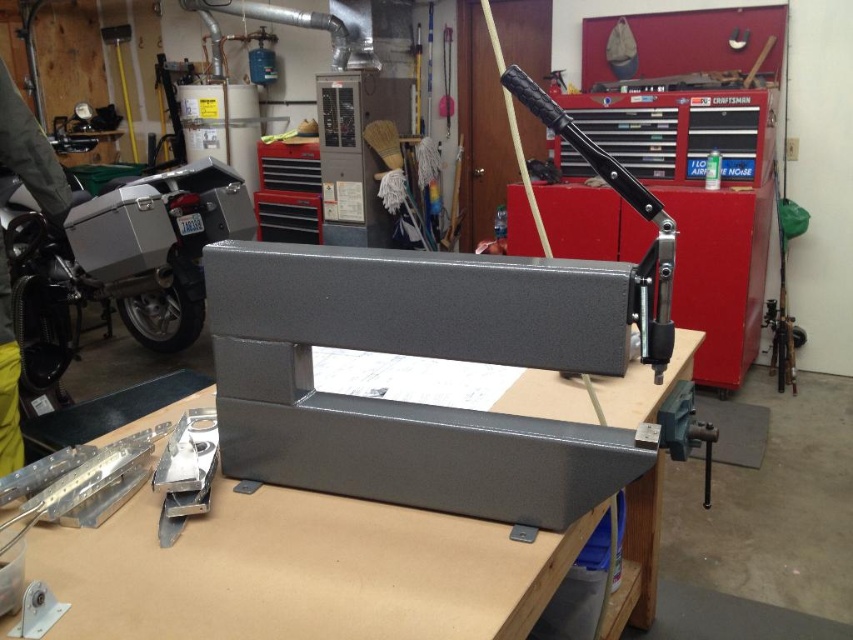
Question: Which object appears farthest from the camera in this image?

Choices:
 (A) matte black handle at upper center
 (B) brushed metal motorcycle at left

Answer: (B)

Question: Which object is closer to the camera taking this photo?

Choices:
 (A) matte black handle at upper center
 (B) brushed metal motorcycle at left

Answer: (A)

Question: Does brushed metal motorcycle at left lie in front of matte black handle at upper center?

Choices:
 (A) no
 (B) yes

Answer: (A)

Question: Does brushed metal motorcycle at left have a larger size compared to matte black handle at upper center?

Choices:
 (A) no
 (B) yes

Answer: (B)

Question: Does brushed metal motorcycle at left come in front of matte black handle at upper center?

Choices:
 (A) yes
 (B) no

Answer: (B)

Question: Which of the following is the farthest from the observer?

Choices:
 (A) (640, 269)
 (B) (86, 298)

Answer: (B)